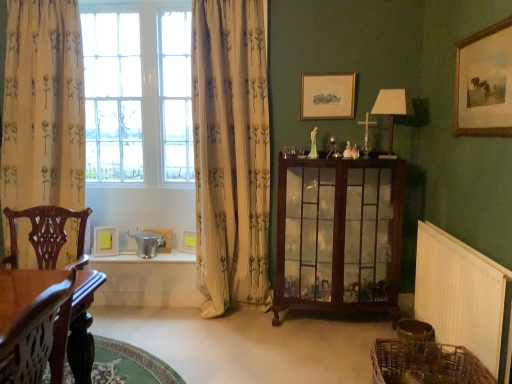
Question: Should I look upward or downward to see white floral fabric curtain at left, the 1th curtain in the left-to-right sequence?

Choices:
 (A) up
 (B) down

Answer: (A)

Question: Can you confirm if yellow paper at window, the 3th picture frame from the back, is thinner than white floral fabric curtain at left, the 1th curtain in the left-to-right sequence?

Choices:
 (A) no
 (B) yes

Answer: (B)

Question: Is yellow paper at window, the fifth picture frame when ordered from right to left, oriented towards white floral fabric curtain at left, the 1th curtain in the left-to-right sequence?

Choices:
 (A) yes
 (B) no

Answer: (B)

Question: Is yellow paper at window, the 3th picture frame from the back, next to white floral fabric curtain at left, arranged as the second curtain when viewed from the right?

Choices:
 (A) yes
 (B) no

Answer: (B)

Question: Can we say yellow paper at window, the first picture frame from the left, lies outside white floral fabric curtain at left, arranged as the second curtain when viewed from the right?

Choices:
 (A) yes
 (B) no

Answer: (A)

Question: Is the position of yellow paper at window, the 3th picture frame from the back, less distant than that of white floral fabric curtain at left, arranged as the second curtain when viewed from the right?

Choices:
 (A) no
 (B) yes

Answer: (A)

Question: Does yellow paper at window, the fifth picture frame when ordered from right to left, have a smaller size compared to white floral fabric curtain at left, the 1th curtain in the left-to-right sequence?

Choices:
 (A) no
 (B) yes

Answer: (B)

Question: Considering the relative positions of mahogany glass cabinet at center and yellow paper at window, which is counted as the third picture frame, starting from the top, in the image provided, is mahogany glass cabinet at center to the left of yellow paper at window, which is counted as the third picture frame, starting from the top, from the viewer's perspective?

Choices:
 (A) yes
 (B) no

Answer: (B)

Question: Considering the relative sizes of mahogany glass cabinet at center and yellow paper at window, acting as the 3th picture frame starting from the bottom, in the image provided, is mahogany glass cabinet at center smaller than yellow paper at window, acting as the 3th picture frame starting from the bottom,?

Choices:
 (A) yes
 (B) no

Answer: (B)

Question: Considering the relative sizes of mahogany glass cabinet at center and yellow paper at window, the first picture frame from the left, in the image provided, is mahogany glass cabinet at center bigger than yellow paper at window, the first picture frame from the left,?

Choices:
 (A) yes
 (B) no

Answer: (A)

Question: Is mahogany glass cabinet at center completely or partially outside of yellow paper at window, the 3th picture frame from the front?

Choices:
 (A) no
 (B) yes

Answer: (B)

Question: From the image's perspective, is mahogany glass cabinet at center below yellow paper at window, acting as the 3th picture frame starting from the bottom?

Choices:
 (A) yes
 (B) no

Answer: (B)

Question: Can you confirm if mahogany glass cabinet at center is shorter than yellow paper at window, the 3th picture frame from the front?

Choices:
 (A) yes
 (B) no

Answer: (B)

Question: Does metallic silver table at lower center have a lesser height compared to white plastic radiator at lower right?

Choices:
 (A) yes
 (B) no

Answer: (A)